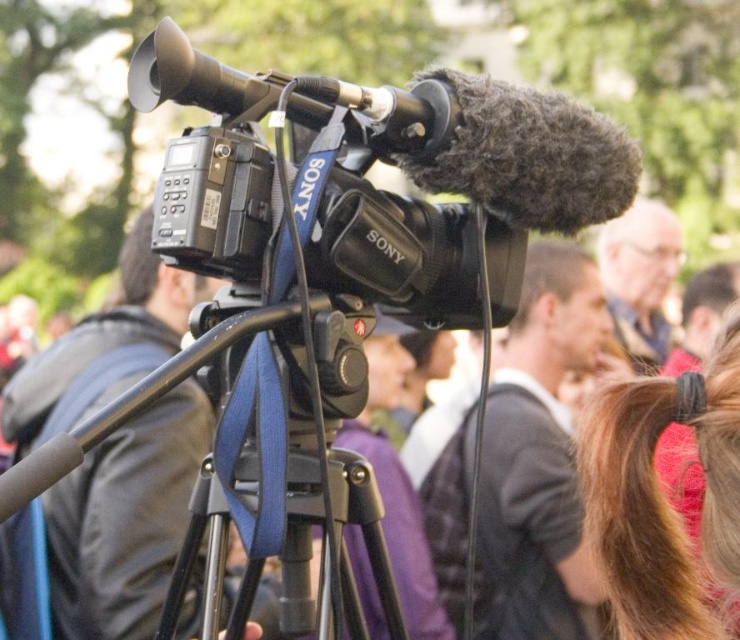
Does black matte camera at center have a lesser width compared to blue fabric tripod at center?

In fact, black matte camera at center might be wider than blue fabric tripod at center.

You are a GUI agent. You are given a task and a screenshot of the screen. Output one action in this format:
    pyautogui.click(x=<x>, y=<y>)
    Task: Click on the black matte camera at center
    This screenshot has height=640, width=740.
    Given the screenshot: What is the action you would take?
    pyautogui.click(x=124, y=520)

What are the coordinates of `black matte camera at center` in the screenshot? It's located at point(124,520).

Between black matte camera at center and dark gray sweater at center, which one is positioned higher?

black matte camera at center is above.

Does black matte camera at center have a lesser width compared to dark gray sweater at center?

Yes, black matte camera at center is thinner than dark gray sweater at center.

I want to click on black matte camera at center, so 124,520.

Who is more forward, (x=485, y=406) or (x=178, y=364)?

Point (x=178, y=364) is more forward.

Is dark gray sweater at center to the right of blue fabric tripod at center from the viewer's perspective?

Correct, you'll find dark gray sweater at center to the right of blue fabric tripod at center.

Is point (559, 346) in front of point (104, 410)?

No, it is not.

Locate an element on the screen. The height and width of the screenshot is (640, 740). dark gray sweater at center is located at coordinates (536, 458).